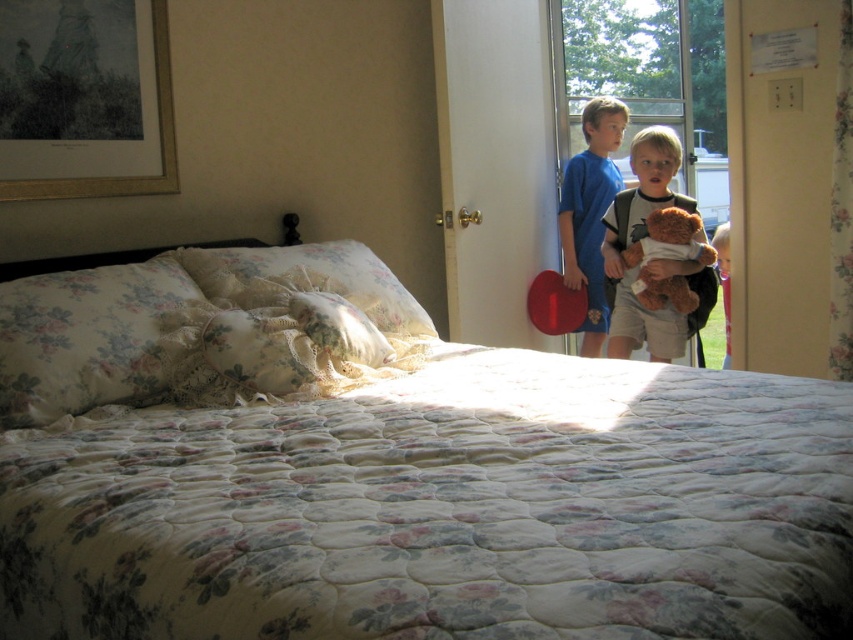
Question: Based on their relative distances, which object is farther from the floral fabric pillow at left?

Choices:
 (A) floral quilted bed at center
 (B) brown plush teddy bear at center
 (C) blue cotton shirt at center

Answer: (C)

Question: Which object is farther from the camera taking this photo?

Choices:
 (A) brown plush bear at center
 (B) blue cotton shirt at center
 (C) brown plush teddy bear at center

Answer: (B)

Question: Does floral quilted bed at center appear on the left side of floral fabric pillow at left?

Choices:
 (A) no
 (B) yes

Answer: (A)

Question: Can you confirm if floral fabric pillow at center is positioned to the left of brown plush teddy bear at center?

Choices:
 (A) yes
 (B) no

Answer: (A)

Question: Where is floral fabric pillow at center located in relation to blue cotton shirt at center in the image?

Choices:
 (A) above
 (B) below

Answer: (B)

Question: Among these objects, which one is nearest to the camera?

Choices:
 (A) blue cotton shirt at center
 (B) floral quilted bed at center
 (C) brown plush bear at center
 (D) floral fabric pillow at left

Answer: (B)